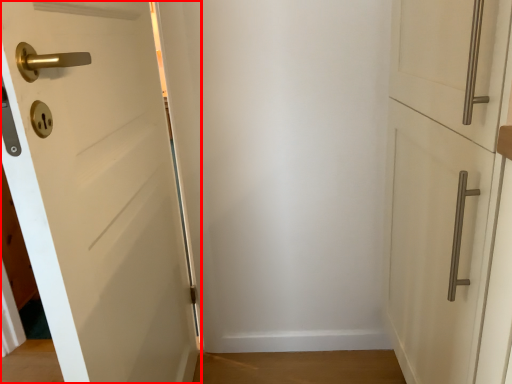
Question: Where is door (annotated by the red box) located in relation to door in the image?

Choices:
 (A) right
 (B) left

Answer: (B)